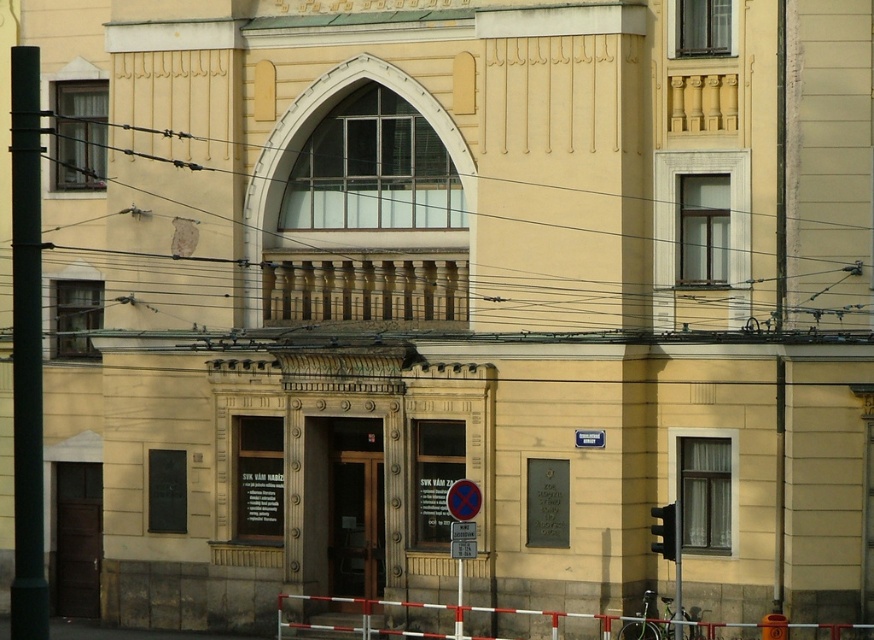
How much distance is there between brown wooden door at center and white/red plastic barrier at lower center?

brown wooden door at center and white/red plastic barrier at lower center are 5.98 meters apart from each other.

Who is taller, brown wooden door at center or white/red plastic barrier at lower center?

Standing taller between the two is brown wooden door at center.

Which is behind, point (363, 572) or point (719, 621)?

The point (363, 572) is behind.

You are a GUI agent. You are given a task and a screenshot of the screen. Output one action in this format:
    pyautogui.click(x=<x>, y=<y>)
    Task: Click on the brown wooden door at center
    Image resolution: width=874 pixels, height=640 pixels.
    Given the screenshot: What is the action you would take?
    pyautogui.click(x=343, y=506)

Can you confirm if brown wooden door at center is smaller than metallic circular sign at center?

Actually, brown wooden door at center might be larger than metallic circular sign at center.

Who is taller, brown wooden door at center or metallic circular sign at center?

With more height is brown wooden door at center.

Does point (331, 536) lie behind point (453, 532)?

That is True.

Image resolution: width=874 pixels, height=640 pixels. Identify the location of brown wooden door at center. (343, 506).

Which is behind, point (66, 545) or point (460, 538)?

The point (66, 545) is behind.

Who is taller, brown wooden door at lower left or metallic circular sign at center?

brown wooden door at lower left is taller.

What do you see at coordinates (77, 538) in the screenshot? The image size is (874, 640). I see `brown wooden door at lower left` at bounding box center [77, 538].

At what (x,y) coordinates should I click in order to perform the action: click on brown wooden door at lower left. Please return your answer as a coordinate pair (x, y). Looking at the image, I should click on (77, 538).